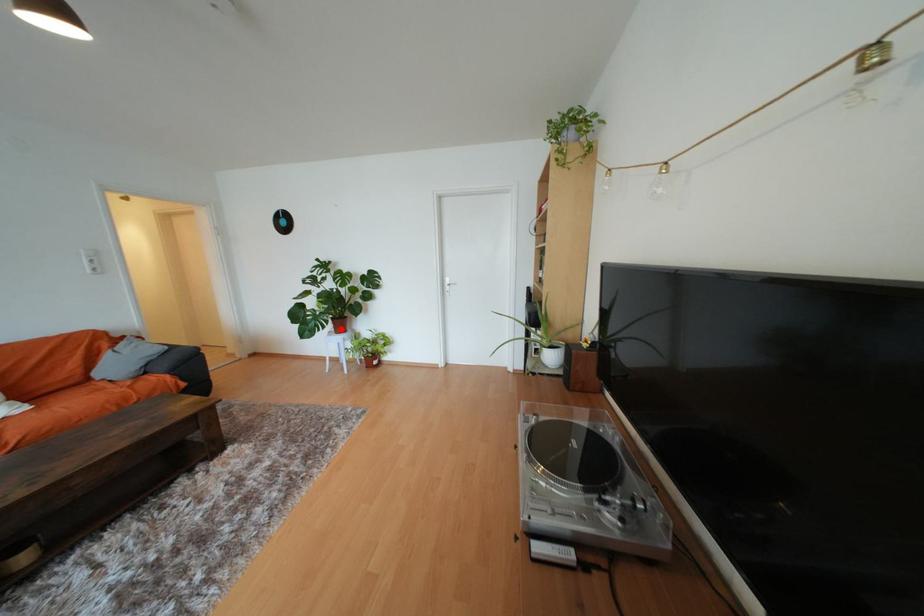
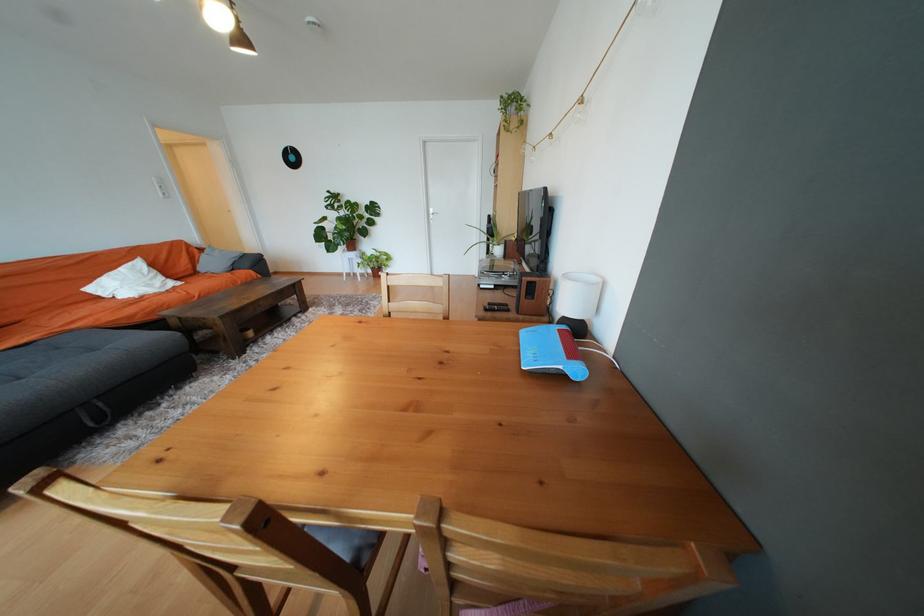
Question: I am providing you with two images of the same scene from different viewpoints. A red point is shown in image1. For the corresponding object point in image2, is it positioned nearer or farther from the camera?

Choices:
 (A) Nearer
 (B) Farther

Answer: (A)